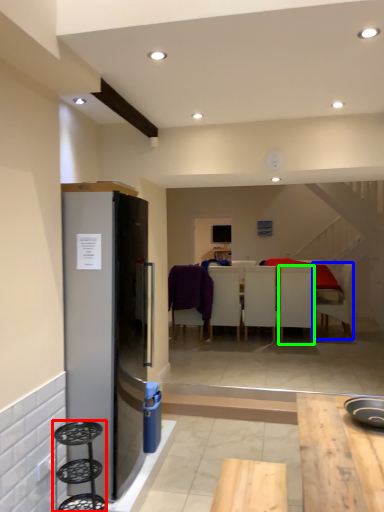
Question: Which is nearer to the bar stool (highlighted by a red box)? chair (highlighted by a blue box) or chair (highlighted by a green box).

Choices:
 (A) chair
 (B) chair

Answer: (B)